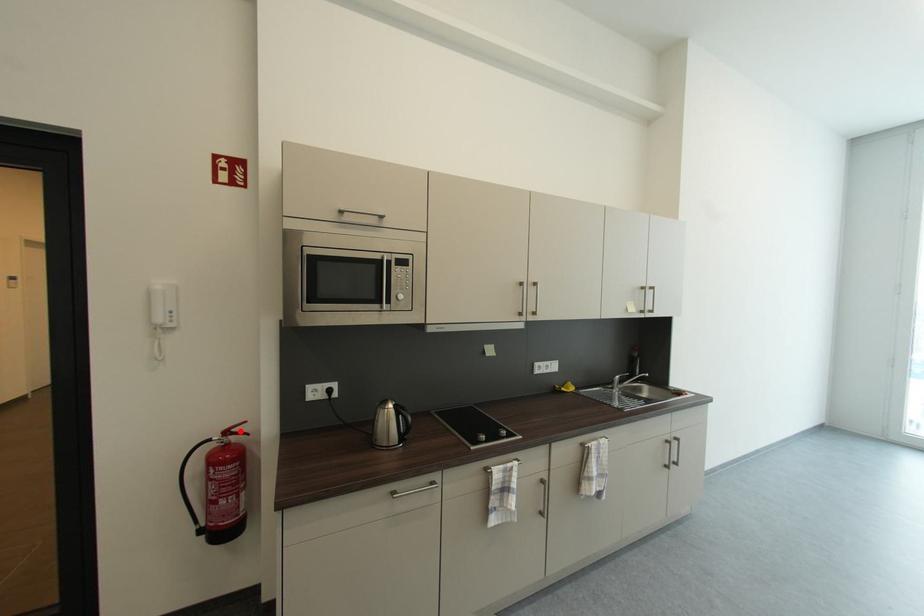
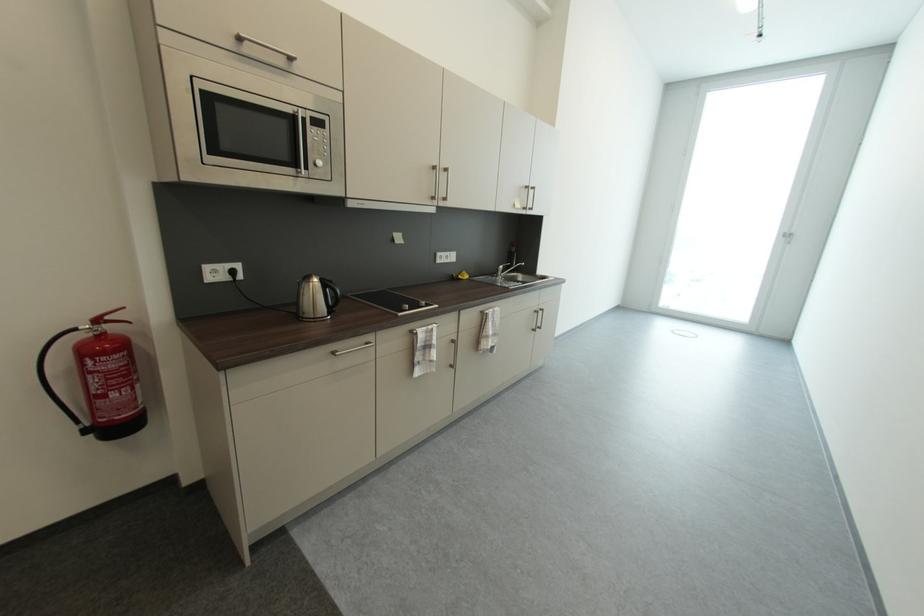
The point at the highlighted location is marked in the first image. Where is the corresponding point in the second image?

(116, 318)